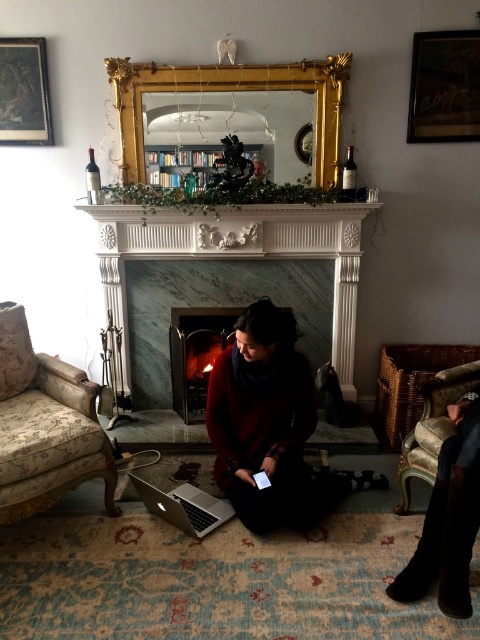
Consider the image. You are sitting in the floral fabric armchair at left and want to place your silver metallic laptop at lower center on the floor next to you. Can you reach it without moving from the chair?

The floral fabric armchair at left is in front of the silver metallic laptop at lower center, so you can reach it easily without moving from the chair.

You are planning to place a large decorative item on the mantelpiece. The item is as big as the floral fabric armchair at left. Will it fit next to the matte black picture frame at upper left?

The floral fabric armchair at left is bigger than the matte black picture frame at upper left. Since the decorative item is as big as the floral fabric armchair at left, it may not fit next to the matte black picture frame at upper left due to size difference.

You are arranging a holiday party and want to place a decorative item between the wooden framed artwork at upper right and the matte black fireplace at center. Where should you place it to be centered between them?

The wooden framed artwork at upper right is positioned on the right side of matte black fireplace at center, so placing the decorative item to the left of the wooden framed artwork at upper right and to the right of the matte black fireplace at center would center it between them.